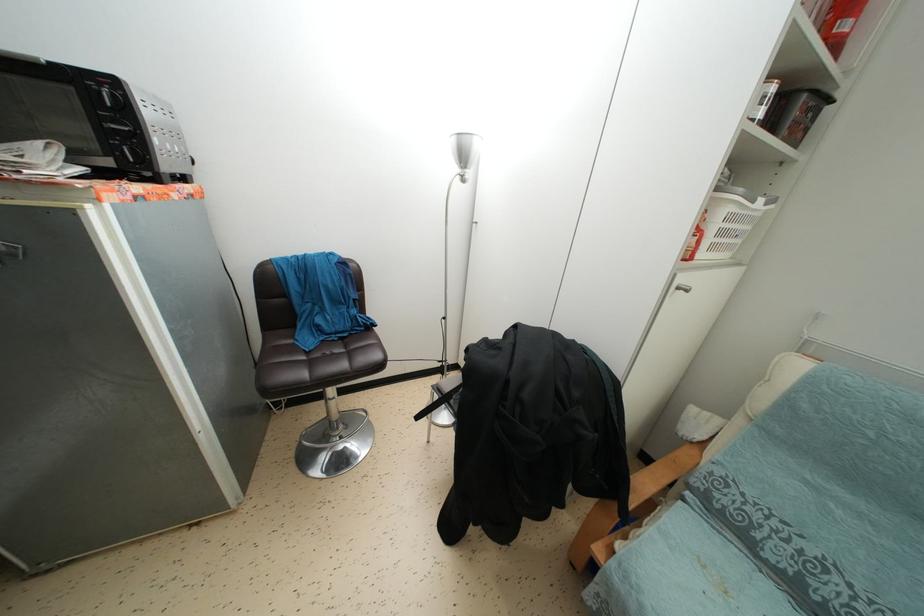
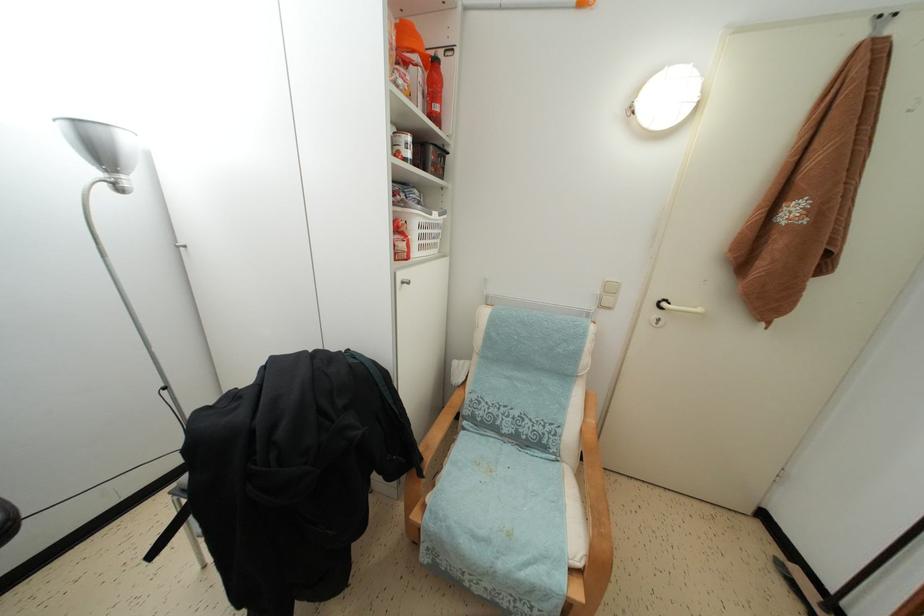
Question: The camera is either moving clockwise (left) or counter-clockwise (right) around the object. The first image is from the beginning of the video and the second image is from the end. Is the camera moving left or right when shooting the video?

Choices:
 (A) Left
 (B) Right

Answer: (A)